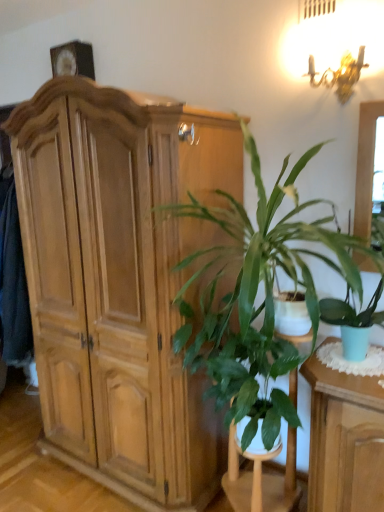
Question: Is green leafy plant at center oriented away from light brown wood cabinet at left?

Choices:
 (A) no
 (B) yes

Answer: (A)

Question: Is green leafy plant at center positioned far away from light brown wood cabinet at left?

Choices:
 (A) no
 (B) yes

Answer: (A)

Question: From a real-world perspective, is green leafy plant at center under light brown wood cabinet at left?

Choices:
 (A) yes
 (B) no

Answer: (A)

Question: From the image's perspective, is green leafy plant at center beneath light brown wood cabinet at left?

Choices:
 (A) yes
 (B) no

Answer: (A)

Question: Is green leafy plant at center next to light brown wood cabinet at left and touching it?

Choices:
 (A) yes
 (B) no

Answer: (B)

Question: From a real-world perspective, is light brown wood cabinet at left positioned above or below green leafy plant at center?

Choices:
 (A) above
 (B) below

Answer: (A)

Question: Is light brown wood cabinet at left inside the boundaries of green leafy plant at center, or outside?

Choices:
 (A) outside
 (B) inside

Answer: (A)

Question: Is light brown wood cabinet at left in front of or behind green leafy plant at center in the image?

Choices:
 (A) front
 (B) behind

Answer: (B)

Question: Based on their positions, is light brown wood cabinet at left located to the left or right of green leafy plant at center?

Choices:
 (A) left
 (B) right

Answer: (A)

Question: Relative to green glossy plant at center, is light brown wood cabinet at left in front or behind?

Choices:
 (A) front
 (B) behind

Answer: (B)

Question: Is light brown wood cabinet at left inside or outside of green glossy plant at center?

Choices:
 (A) outside
 (B) inside

Answer: (A)

Question: In terms of height, does light brown wood cabinet at left look taller or shorter compared to green glossy plant at center?

Choices:
 (A) short
 (B) tall

Answer: (B)

Question: In the image, is light brown wood cabinet at left on the left side or the right side of green glossy plant at center?

Choices:
 (A) right
 (B) left

Answer: (B)

Question: Considering the positions of point (289, 374) and point (190, 260), is point (289, 374) closer or farther from the camera than point (190, 260)?

Choices:
 (A) farther
 (B) closer

Answer: (A)

Question: From the image's perspective, is green leafy plant at center located above or below green glossy plant at center?

Choices:
 (A) below
 (B) above

Answer: (A)